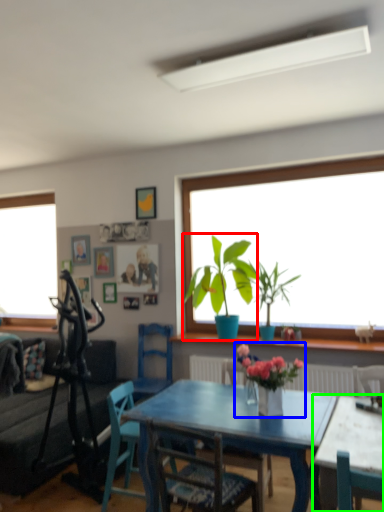
Question: Based on their relative distances, which object is nearer to houseplant (highlighted by a red box)? Choose from floral arrangement (highlighted by a blue box) and table (highlighted by a green box).

Choices:
 (A) floral arrangement
 (B) table

Answer: (A)